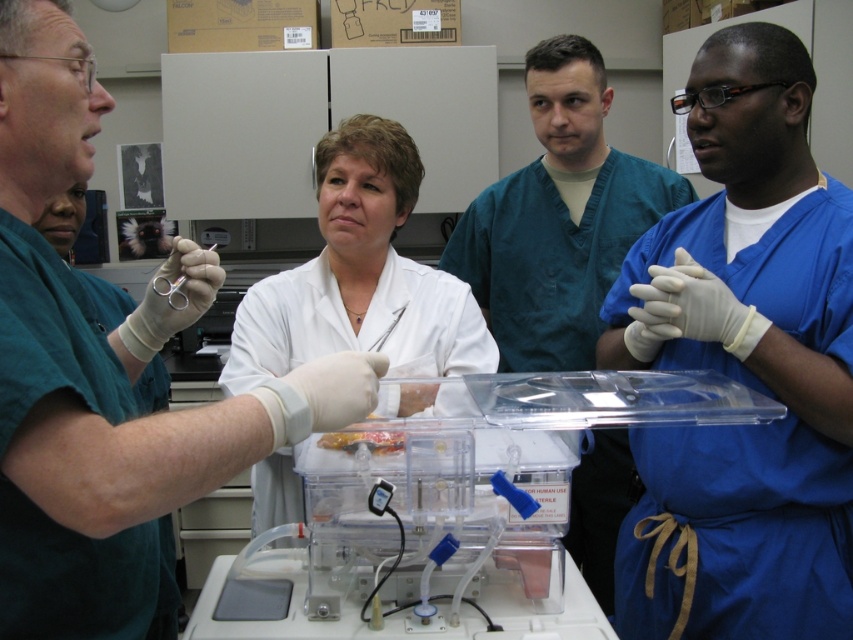
Please provide the coordinates of the blue scrubs at center in the image. The coordinates should be in the format of a tuple with two decimal numbers separated by a comma, enclosed in parentheses. For example, if the coordinates were at the center of the image, it would be written as follows. The answer should only contain the coordinates and no other text. The coordinates must be exactly as provided in the Objects Description. The answer must be in English. The answer must be in the following format. The X

The coordinates of the blue scrubs at center are at point [558,218]. So the answer is the tuple with those numbers in parentheses. But the user wants only the coordinates in the answer. So just write the tuple. The user also specified to use exactly the numbers from the Objects Description. The Objects Description says the position is at point [558,218]. So the answer should be exactly that in parentheses with commas. The user said to not include any other text. So the answer is simply the tuple as in

In the laboratory scene, there are four people wearing surgical scrubs. The person in blue scrubs at right is holding gloves. Where is the point at coordinate (743, 365) located in relation to the blue scrubs at right?

The point at coordinate (743, 365) corresponds to the blue scrubs at right.

You are a medical student standing in the lab and need to hand a tool to the person in blue scrubs. Which one should you approach first, the blue scrubs at right or the blue scrubs at center?

You should approach the blue scrubs at right first because they are closer to you than the blue scrubs at center.